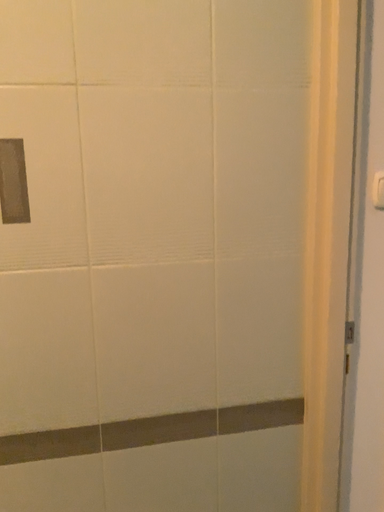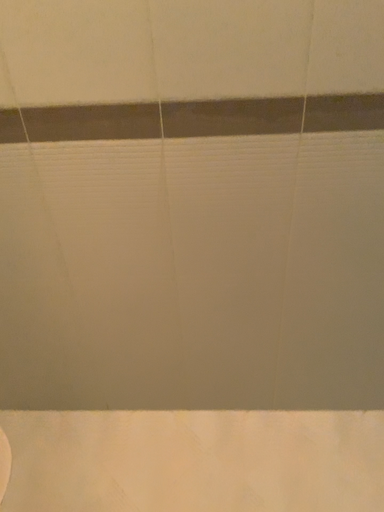
Question: How did the camera likely rotate when shooting the video?

Choices:
 (A) rotated left
 (B) rotated right

Answer: (A)